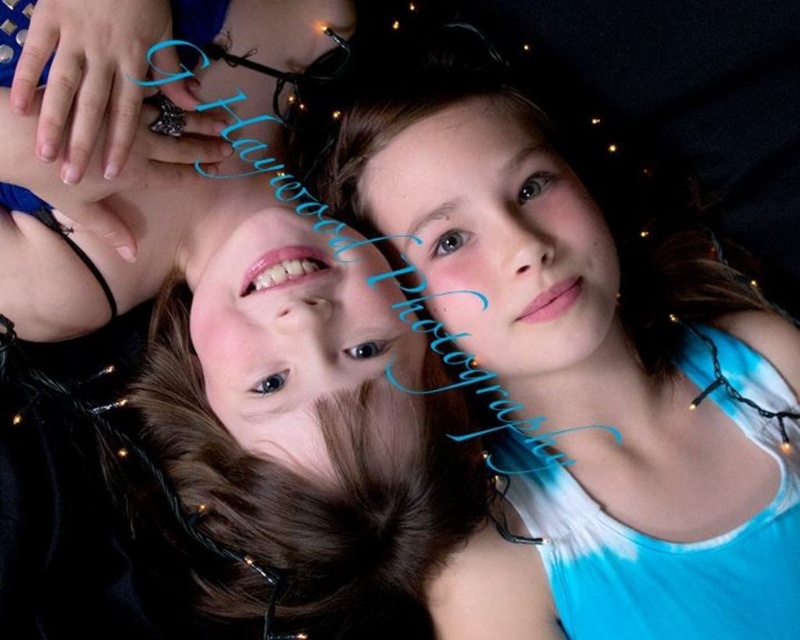
Is blue tie-dye tank top at upper center wider than blue tie-dye tank top at upper right?

Indeed, blue tie-dye tank top at upper center has a greater width compared to blue tie-dye tank top at upper right.

Who is more distant from viewer, (162,220) or (636,404)?

Positioned behind is point (162,220).

Identify the location of blue tie-dye tank top at upper center. Image resolution: width=800 pixels, height=640 pixels. (240, 381).

Identify the location of blue tie-dye tank top at upper center. The width and height of the screenshot is (800, 640). (240, 381).